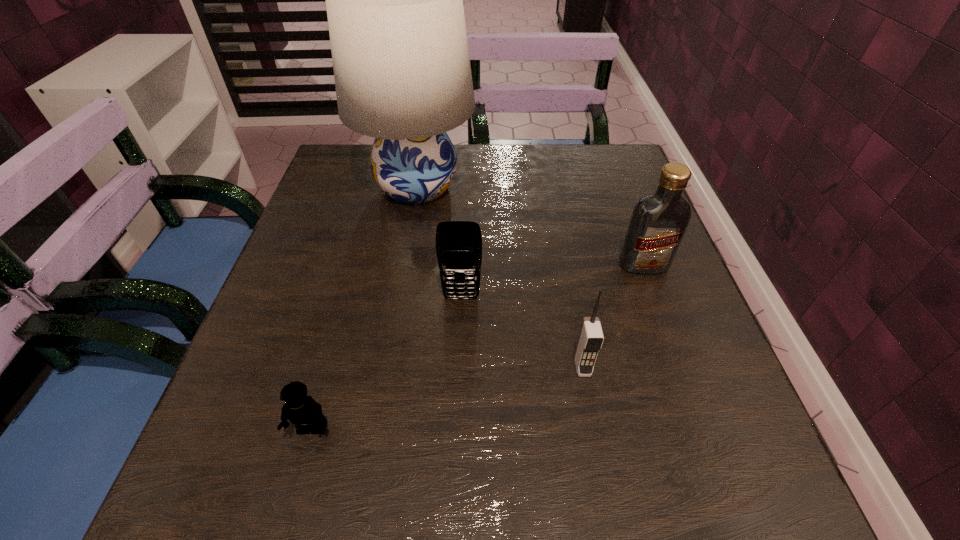
Identify the location of vacant space located on the front-facing side of the farthest object. (638, 187).

Where is `vacant space located on the front-facing side of the rightmost object`? Image resolution: width=960 pixels, height=540 pixels. vacant space located on the front-facing side of the rightmost object is located at coordinates (697, 411).

This screenshot has height=540, width=960. In order to click on vacant space located 0.370m on the screen of the left cellular telephone in this screenshot , I will do `click(452, 524)`.

The height and width of the screenshot is (540, 960). Find the location of `vacant space located 0.120m on the front-facing side of the nearer cellular telephone`. vacant space located 0.120m on the front-facing side of the nearer cellular telephone is located at coordinates (598, 451).

This screenshot has width=960, height=540. What are the coordinates of `free region located on the front-facing side of the Lego` in the screenshot? It's located at (287, 519).

Locate an element on the screen. object that is at the far edge is located at coordinates (394, 0).

Where is `lampshade located in the left edge section of the desktop`? This screenshot has width=960, height=540. lampshade located in the left edge section of the desktop is located at coordinates (394, 0).

The width and height of the screenshot is (960, 540). In order to click on Lego present at the left edge in this screenshot , I will do `click(303, 411)`.

Identify the location of object located in the right edge section of the desktop. (659, 220).

The image size is (960, 540). I want to click on object present at the far left corner, so click(394, 0).